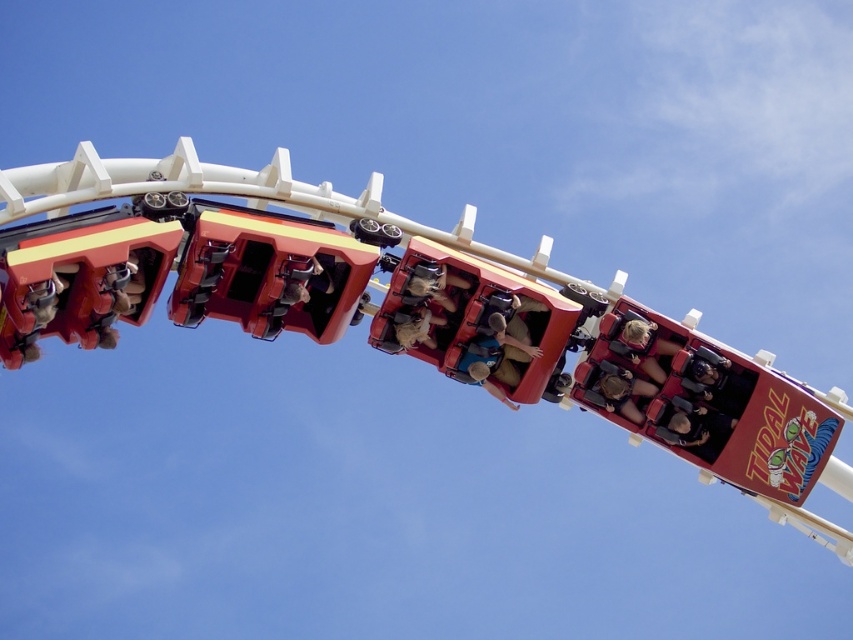
Question: Does matte black helmet at center lie in front of light brown leather helmet at center?

Choices:
 (A) no
 (B) yes

Answer: (A)

Question: Among these objects, which one is nearest to the camera?

Choices:
 (A) brown leather jacket at center
 (B) matte brown hair at center
 (C) metallic red roller coaster car at center

Answer: (C)

Question: Which point is closer to the camera?

Choices:
 (A) (621, 385)
 (B) (503, 340)
 (C) (631, 337)
 (D) (328, 324)

Answer: (D)

Question: Observing the image, what is the correct spatial positioning of metallic red roller coaster car at center in reference to matte brown hair at center?

Choices:
 (A) left
 (B) right

Answer: (A)

Question: Can you confirm if brown leather jacket at center is positioned to the left of light brown leather helmet at center?

Choices:
 (A) no
 (B) yes

Answer: (A)

Question: Which point appears farthest from the camera in this image?

Choices:
 (A) (639, 349)
 (B) (370, 176)
 (C) (515, 364)

Answer: (B)